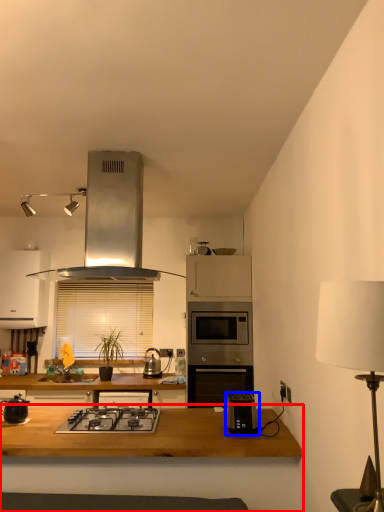
Question: Which object is closer to the camera taking this photo, table (highlighted by a red box) or toaster (highlighted by a blue box)?

Choices:
 (A) table
 (B) toaster

Answer: (A)